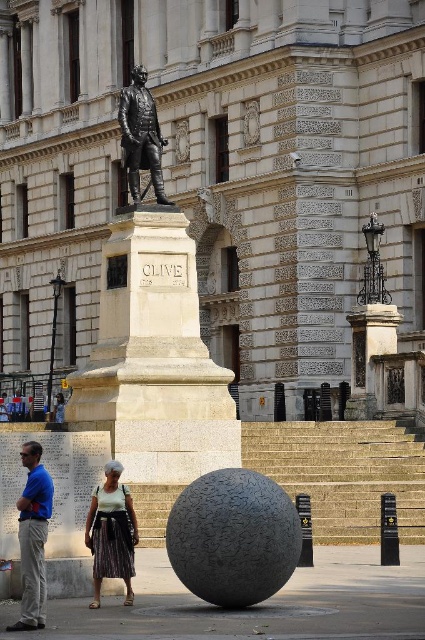
Is polished bronze statue at center to the left of blue shirt at lower left from the viewer's perspective?

Correct, you'll find polished bronze statue at center to the left of blue shirt at lower left.

Is the position of polished bronze statue at center more distant than that of blue shirt at lower left?

Yes, it is behind blue shirt at lower left.

Is point (99, 348) farther from viewer compared to point (42, 605)?

Yes.

At what (x,y) coordinates should I click in order to perform the action: click on polished bronze statue at center. Please return your answer as a coordinate pair (x, y). Image resolution: width=425 pixels, height=640 pixels. Looking at the image, I should click on [147, 300].

Is polished bronze statue at center further to camera compared to white textured blouse at lower center?

Yes, polished bronze statue at center is further from the viewer.

Does polished bronze statue at center appear on the left side of white textured blouse at lower center?

Correct, you'll find polished bronze statue at center to the left of white textured blouse at lower center.

Is point (122, 218) more distant than point (85, 531)?

Yes.

Find the location of a particular element. Image resolution: width=425 pixels, height=640 pixels. polished bronze statue at center is located at coordinates (147, 300).

Is white textured blouse at lower center bigger than bronze statue at center?

No.

Which is in front, point (96, 573) or point (155, 118)?

Point (96, 573)

In order to click on white textured blouse at lower center in this screenshot , I will do `click(112, 532)`.